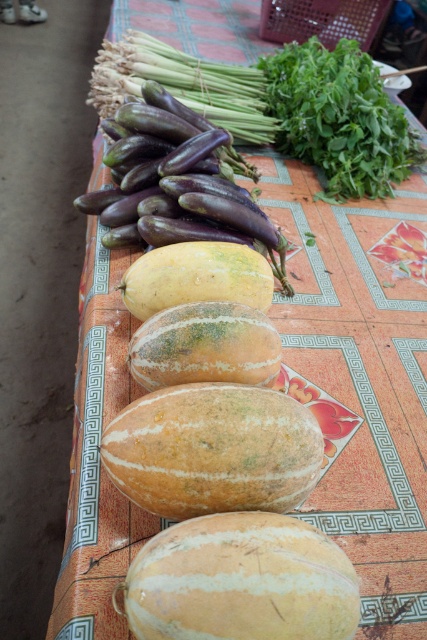
You are standing 2 feet away from the table. Can you reach the purple matte eggplant at center without moving closer?

The purple matte eggplant at center is 3.53 feet away from the viewer. Since you are already 2 feet away from the table, the total distance would be 2 feet plus the distance from the table to the eggplant. However, the provided information only specifies the eggplant is 3.53 feet from the viewer, not accounting for the table distance. Without knowing the table length, we can only confirm the eggplant is 3.53 feet away from your current position. If the table is between you and the eggplant, you might need a